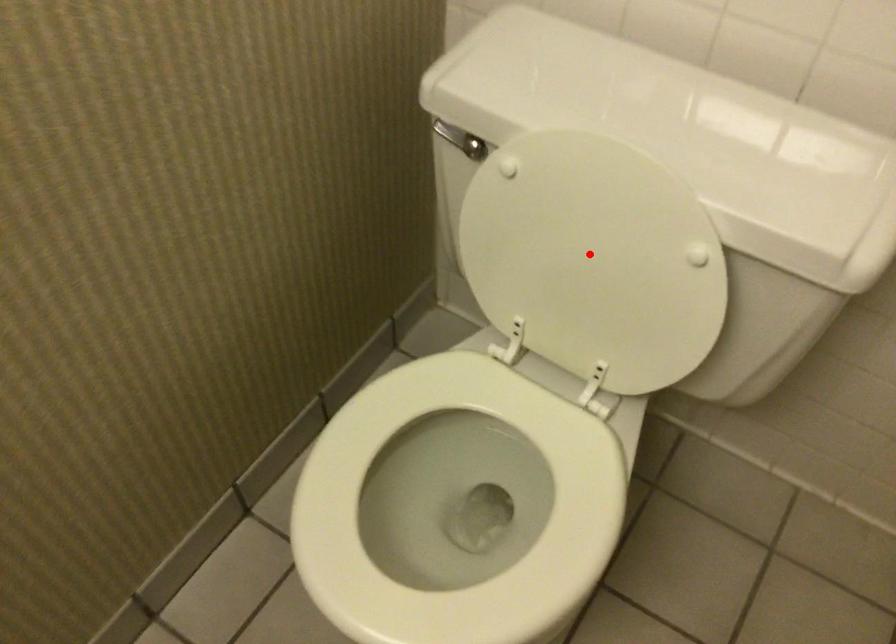
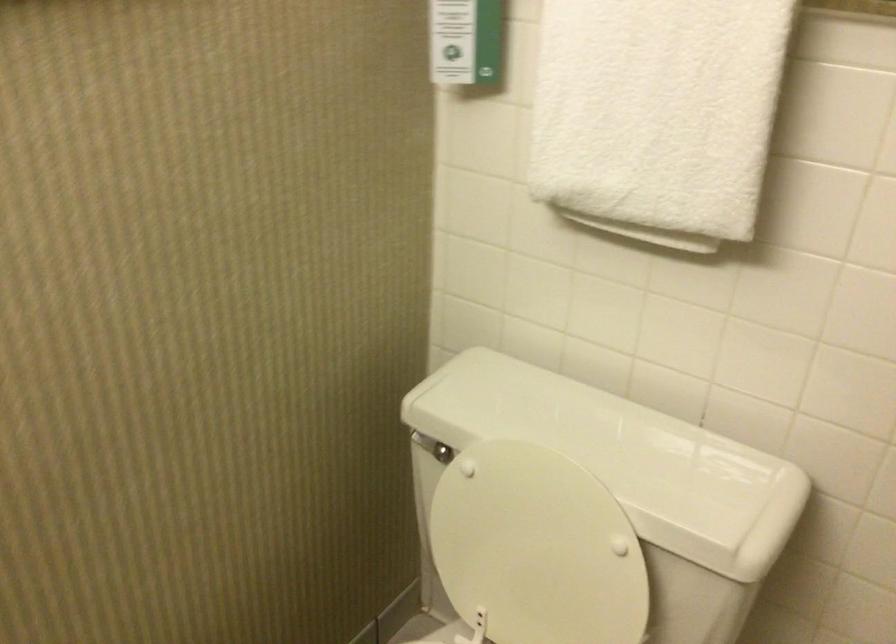
Question: I am providing you with two images of the same scene from different viewpoints. A red point is shown in image1. For the corresponding object point in image2, is it positioned nearer or farther from the camera?

Choices:
 (A) Nearer
 (B) Farther

Answer: (B)